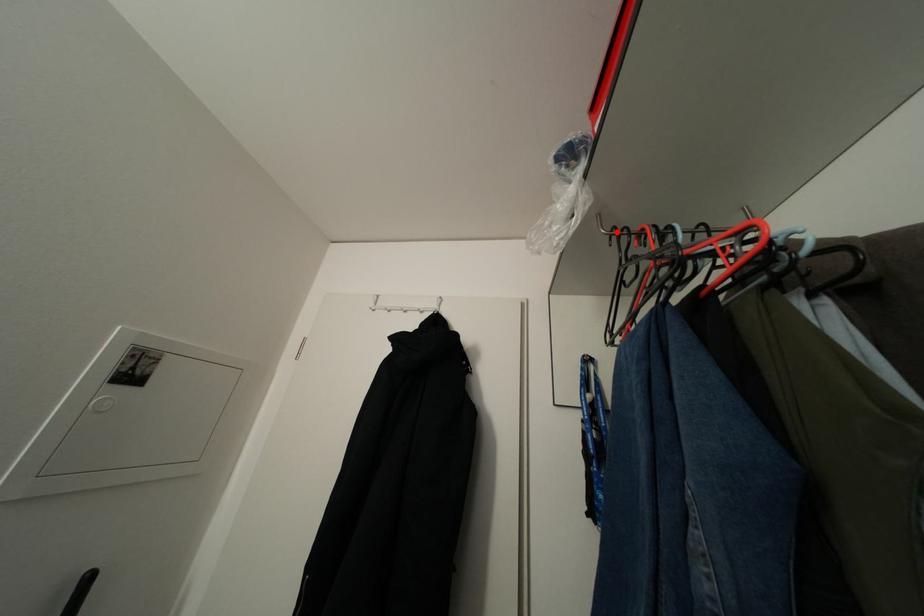
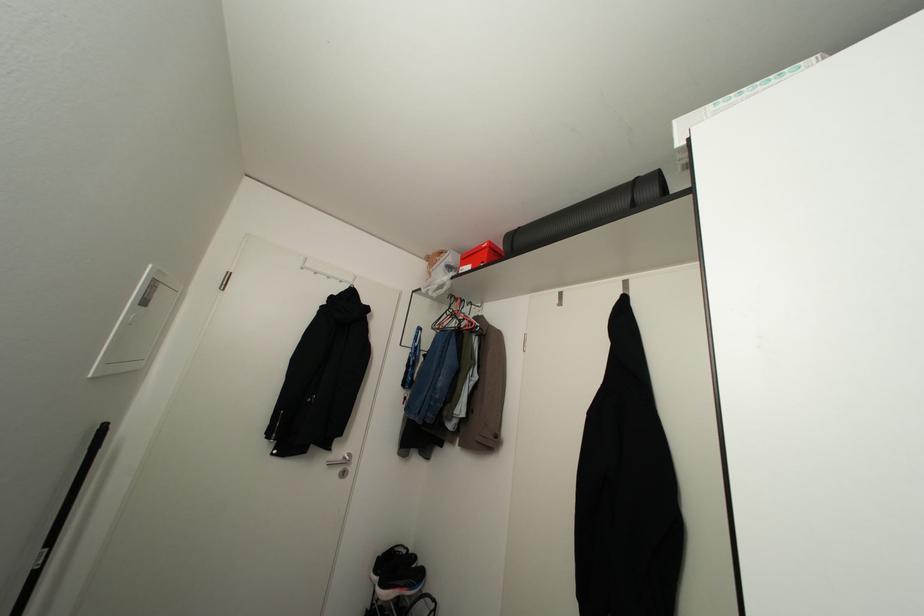
In the second image, find the point that corresponds to the highlighted location in the first image.

(451, 294)